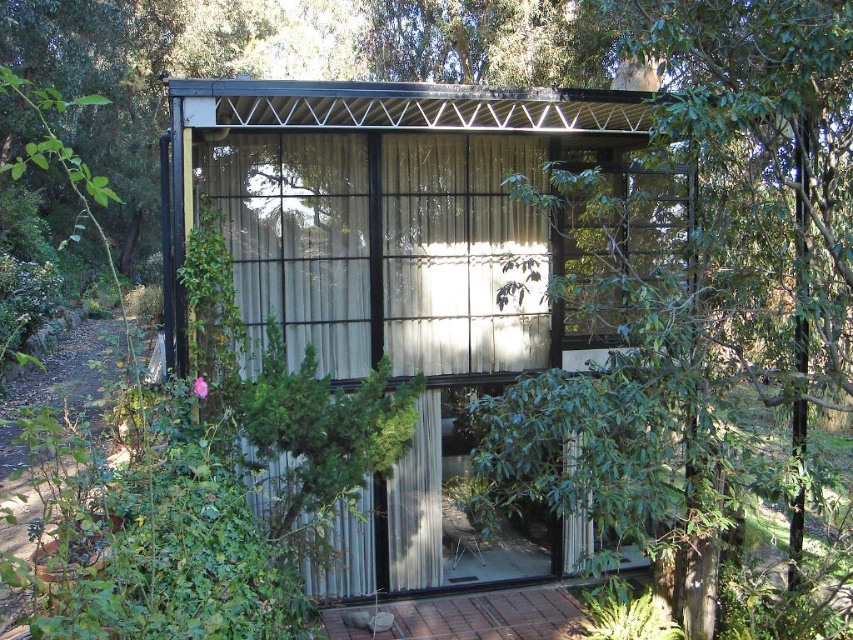
You are standing at the entrance of the building and want to locate the green leafy tree at center. According to the coordinates provided, where should you look relative to your position?

The green leafy tree at center is located at coordinates point (701, 305), which means it is positioned slightly to the right and lower from your central viewpoint.

Based on the photo, you are a gardener who wants to plant a new tree that requires 8 feet of space between it and any existing structures. You see the green leafy tree at center and the metallic corrugated hut at center. Can you plant the new tree between them without violating the space requirement?

The distance between the green leafy tree at center and the metallic corrugated hut at center is 7.25 feet. Since the required space is 8 feet, planting a new tree between them would not meet the requirement as the existing distance is less than the required 8 feet.